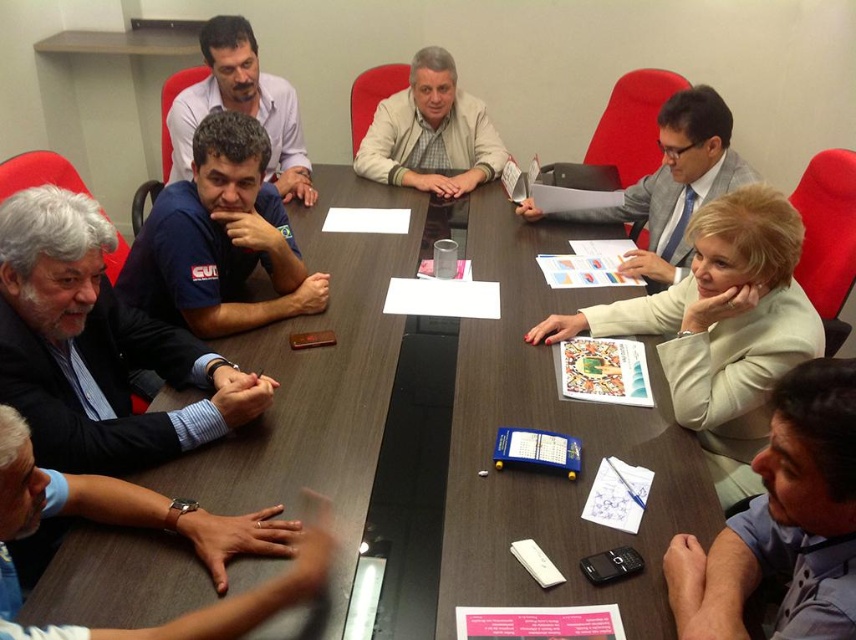
Question: Which object is closer to the camera taking this photo?

Choices:
 (A) blue shirt at lower left
 (B) dark wood table at center
 (C) light beige jacket at center
 (D) gray hair man at left

Answer: (A)

Question: Does gray hair man at left come behind cardboard paper at center?

Choices:
 (A) yes
 (B) no

Answer: (B)

Question: Which is nearer to the blue shirt at lower left?

Choices:
 (A) dark wood table at center
 (B) gray shirt at upper right

Answer: (A)

Question: Which is nearer to the light beige fabric jacket at right?

Choices:
 (A) light beige jacket at center
 (B) blue shirt at lower left

Answer: (B)

Question: Does light beige fabric jacket at right have a smaller size compared to light beige jacket at center?

Choices:
 (A) no
 (B) yes

Answer: (A)

Question: Does light beige fabric jacket at right appear on the right side of matte blue shirt at center?

Choices:
 (A) no
 (B) yes

Answer: (B)